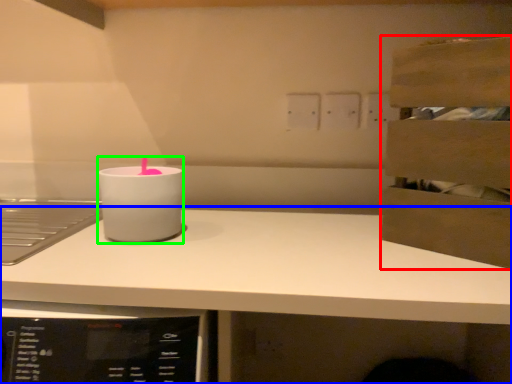
Question: Which object is the farthest from cabinetry (highlighted by a red box)? Choose among these: countertop (highlighted by a blue box) or candle holder (highlighted by a green box).

Choices:
 (A) countertop
 (B) candle holder

Answer: (B)